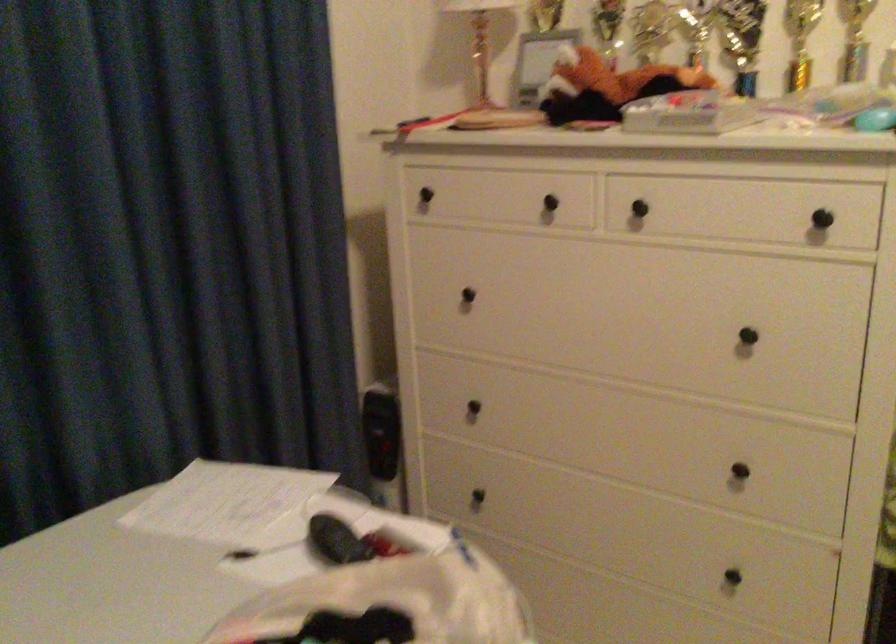
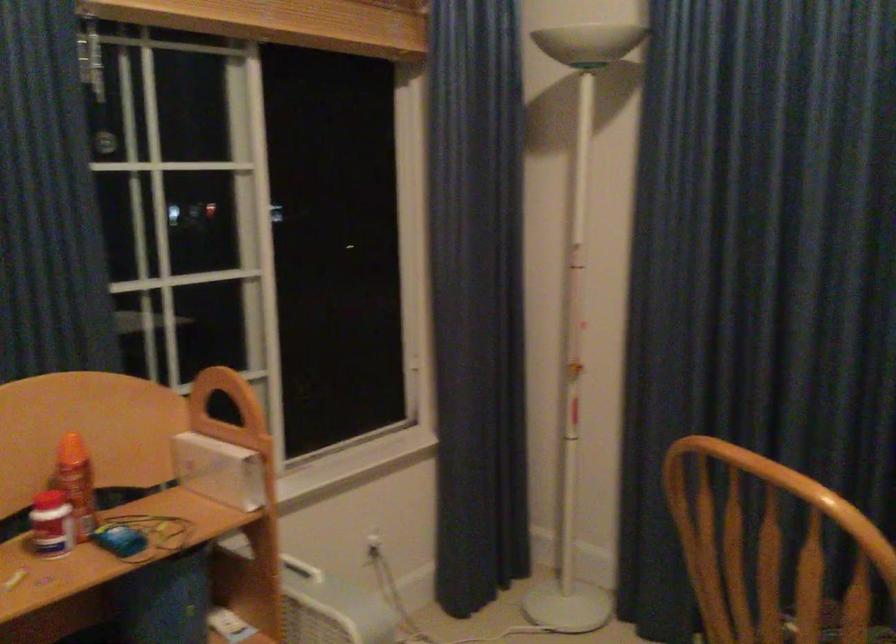
Question: The camera is either moving clockwise (left) or counter-clockwise (right) around the object. The first image is from the beginning of the video and the second image is from the end. Is the camera moving left or right when shooting the video?

Choices:
 (A) Left
 (B) Right

Answer: (B)